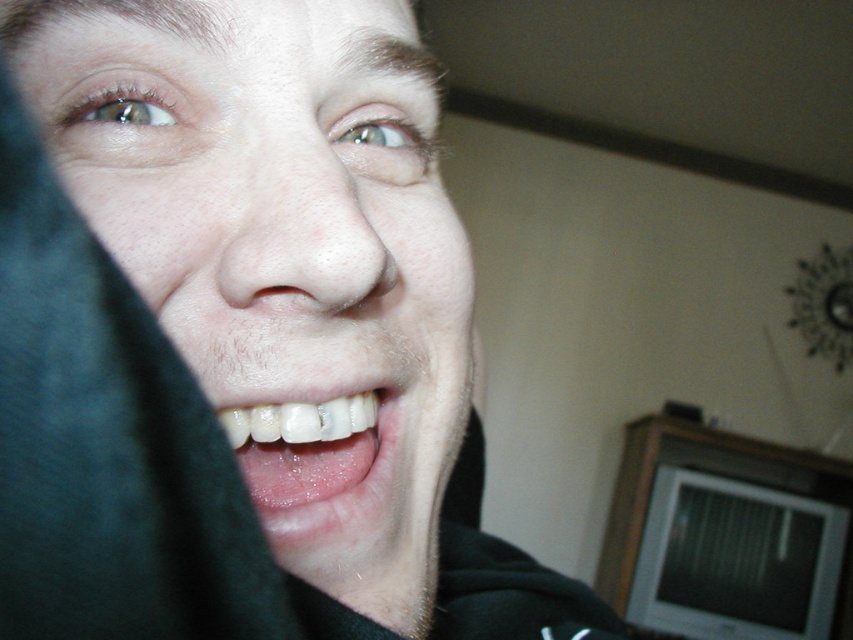
Who is shorter, matte black face at center or white glossy teeth at center?

white glossy teeth at center

Does matte black face at center appear on the left side of white glossy teeth at center?

Incorrect, matte black face at center is not on the left side of white glossy teeth at center.

Who is more distant from viewer, [370,285] or [325,516]?

The point [325,516] is behind.

Identify the location of matte black face at center. The height and width of the screenshot is (640, 853). (279, 246).